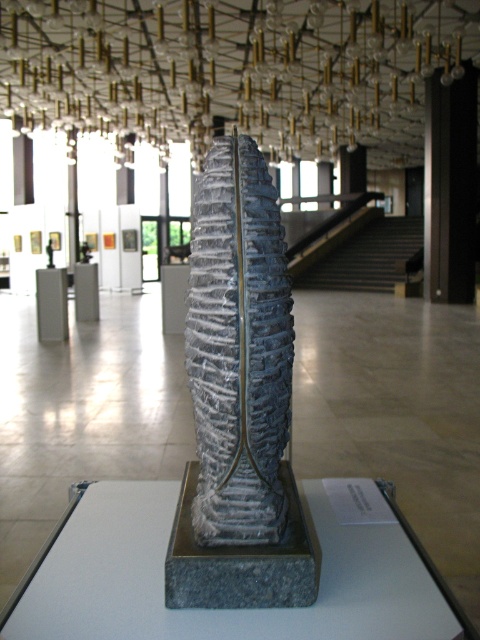
Question: Which point appears closest to the camera in this image?

Choices:
 (A) (203, 547)
 (B) (451, 280)
 (C) (48, 285)

Answer: (A)

Question: Is gray textured stone column at center to the left of black polished pillar at right from the viewer's perspective?

Choices:
 (A) no
 (B) yes

Answer: (B)

Question: Is black polished pillar at right behind gray stone pillar at center?

Choices:
 (A) yes
 (B) no

Answer: (A)

Question: From the image, what is the correct spatial relationship of gray textured stone column at center in relation to black polished pillar at right?

Choices:
 (A) right
 (B) left

Answer: (B)

Question: Which point is farther to the camera?

Choices:
 (A) (450, 113)
 (B) (59, 310)
 (C) (259, 266)

Answer: (A)

Question: Based on their relative distances, which object is nearer to the gray textured stone column at center?

Choices:
 (A) black polished pillar at right
 (B) gray stone pillar at center

Answer: (B)